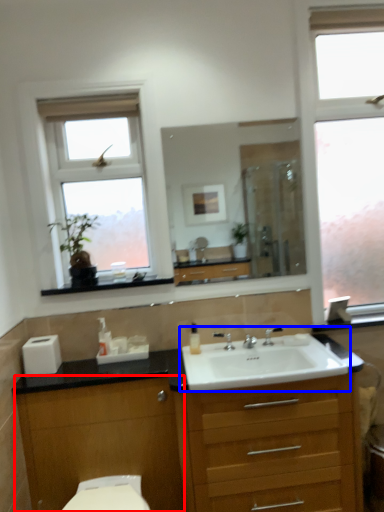
Question: Which object is closer to the camera taking this photo, cabinetry (highlighted by a red box) or sink (highlighted by a blue box)?

Choices:
 (A) cabinetry
 (B) sink

Answer: (B)